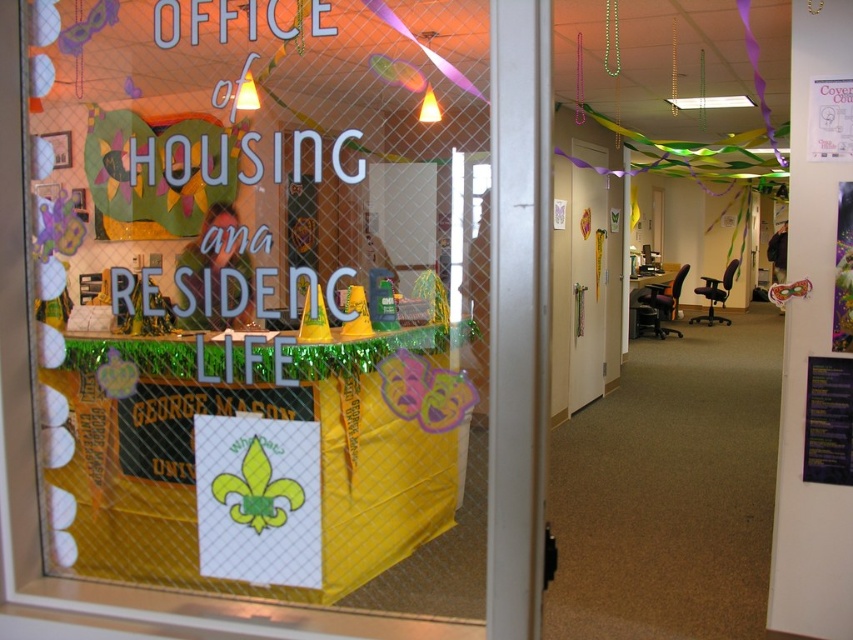
Between yellow fabric at center and white glossy door at center, which one is positioned lower?

yellow fabric at center is lower down.

Measure the distance between point (190, 340) and camera.

They are 8.58 feet apart.

Find the location of `yellow fabric at center`. yellow fabric at center is located at coordinates (282, 304).